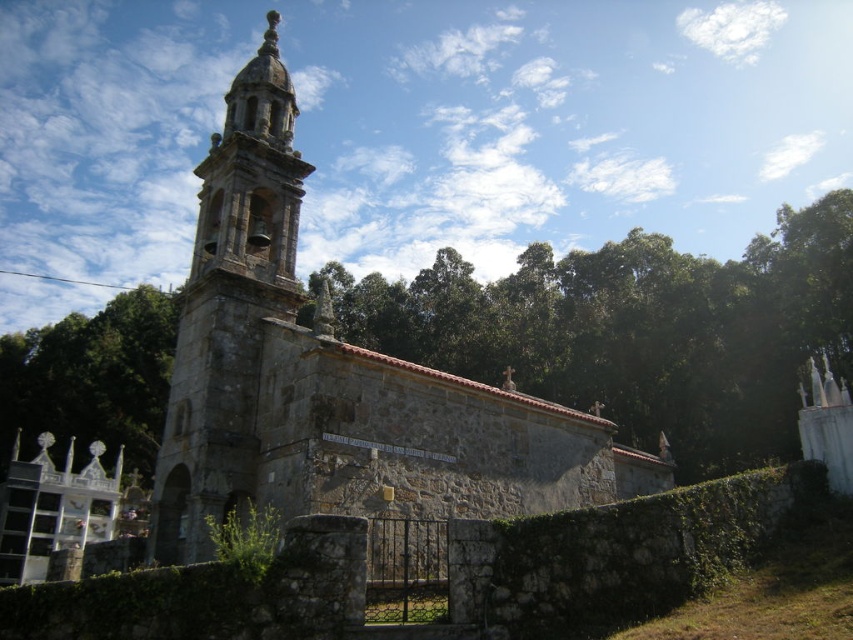
How distant is stone church at center from green leafy trees at center?

The distance of stone church at center from green leafy trees at center is 40.31 meters.

Is stone church at center positioned at the back of green leafy trees at center?

That is False.

I want to click on stone church at center, so click(x=335, y=380).

Between green leafy trees at center and green leafy tree at left, which one is positioned higher?

Positioned higher is green leafy trees at center.

This screenshot has width=853, height=640. What do you see at coordinates (637, 330) in the screenshot? I see `green leafy trees at center` at bounding box center [637, 330].

You are a GUI agent. You are given a task and a screenshot of the screen. Output one action in this format:
    pyautogui.click(x=<x>, y=<y>)
    Task: Click on the green leafy trees at center
    This screenshot has height=640, width=853.
    Given the screenshot: What is the action you would take?
    pyautogui.click(x=637, y=330)

Between stone church at center and green leafy tree at left, which one has more height?

stone church at center is taller.

Which is in front, point (635, 467) or point (85, 316)?

Point (635, 467) is in front.

Where is `stone church at center`? The width and height of the screenshot is (853, 640). stone church at center is located at coordinates pos(335,380).

Locate an element on the screen. The width and height of the screenshot is (853, 640). stone church at center is located at coordinates (335, 380).